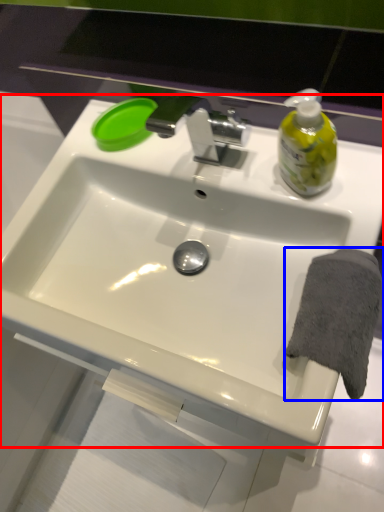
Question: Which point is closer to the camera, sink (highlighted by a red box) or bath towel (highlighted by a blue box)?

Choices:
 (A) sink
 (B) bath towel

Answer: (A)